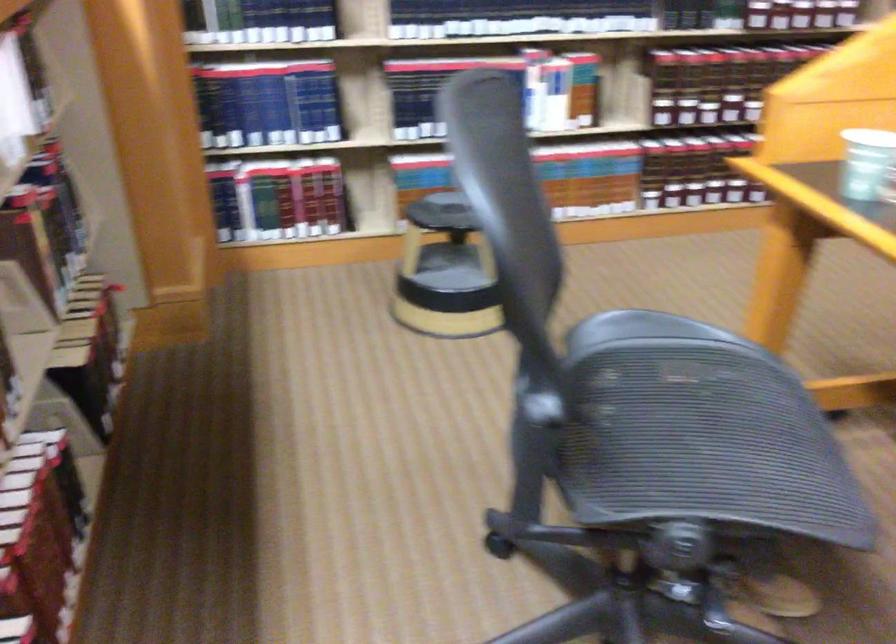
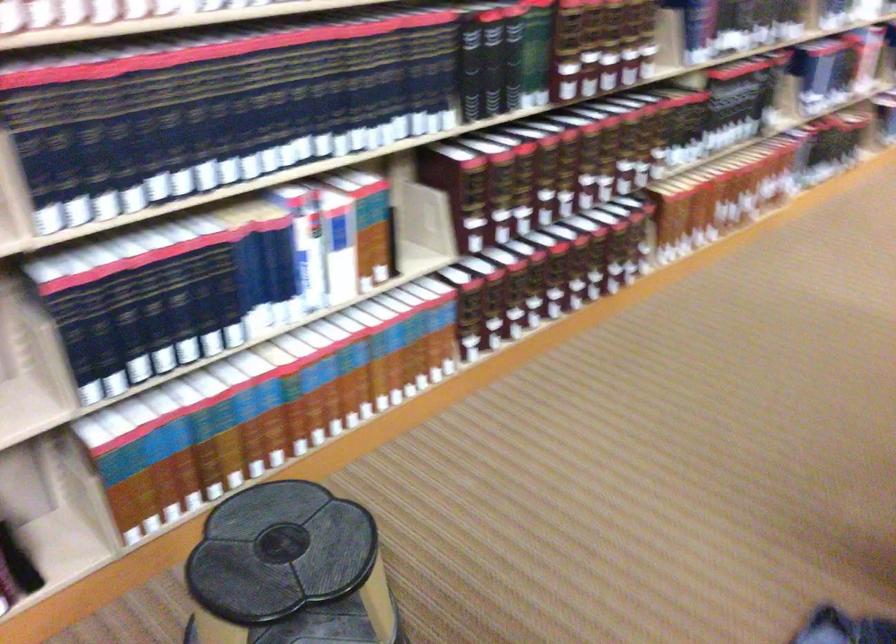
Where in the second image is the point corresponding to point (640, 100) from the first image?

(421, 228)